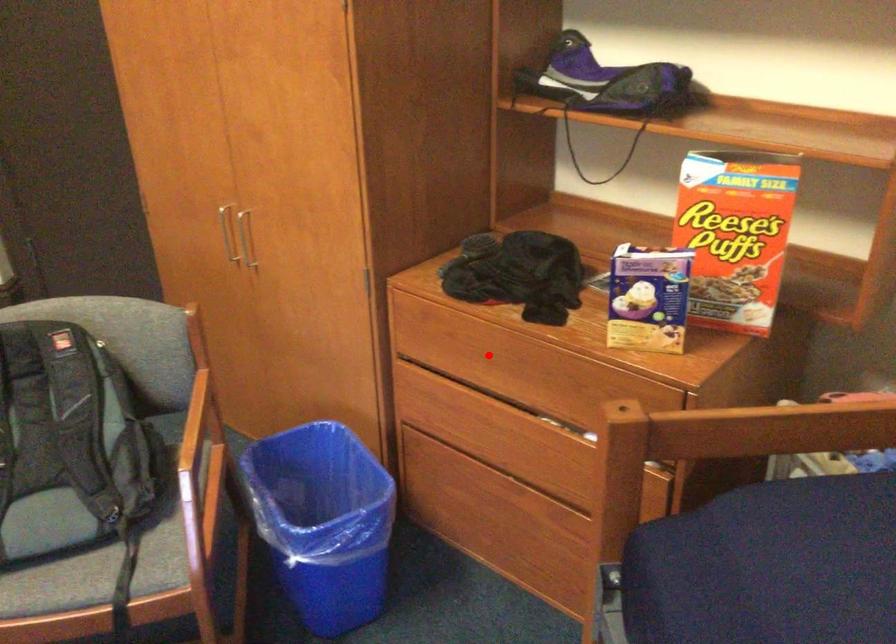
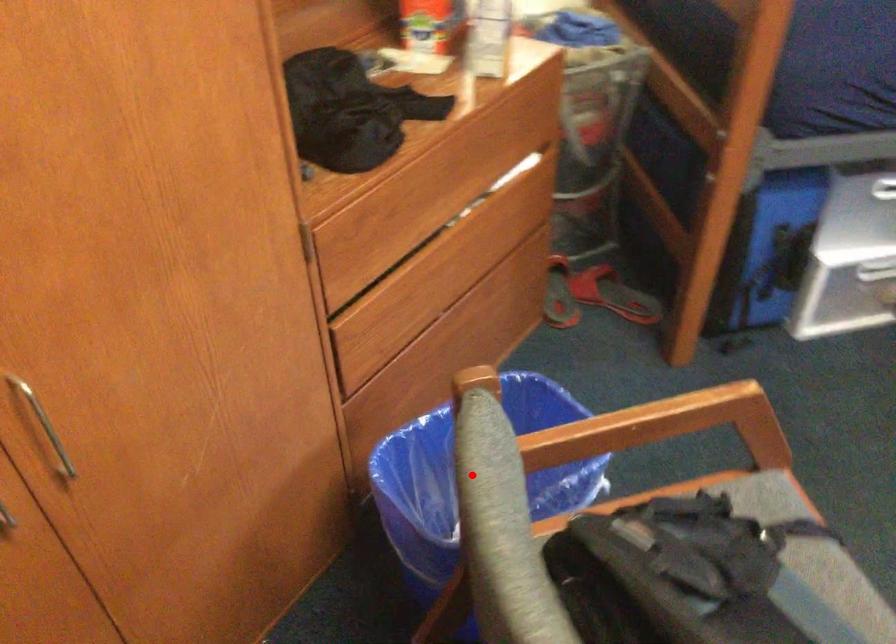
I am providing you with two images of the same scene from different viewpoints. A red point is marked on the first image and another point is marked on the second image. Is the red point in image1 aligned with the point shown in image2?

No